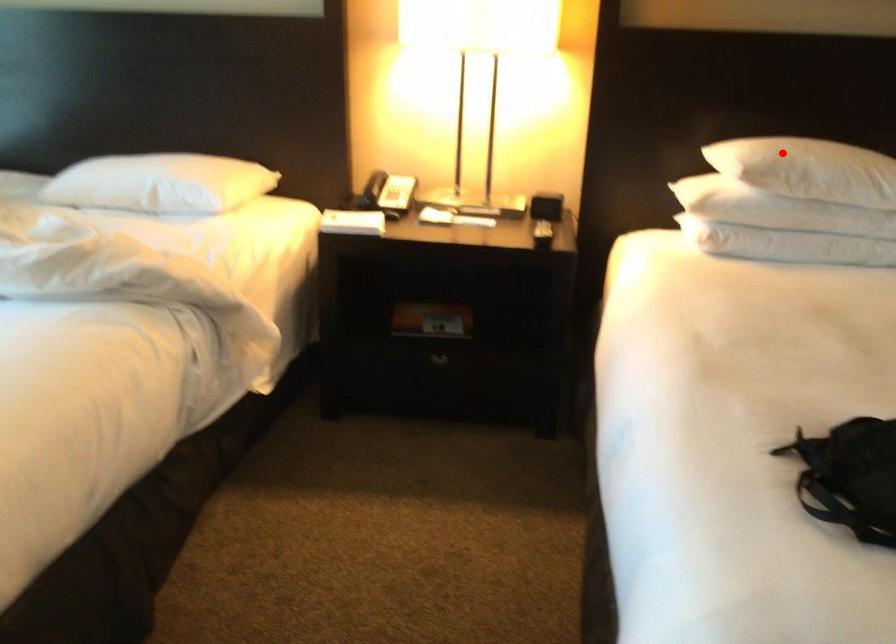
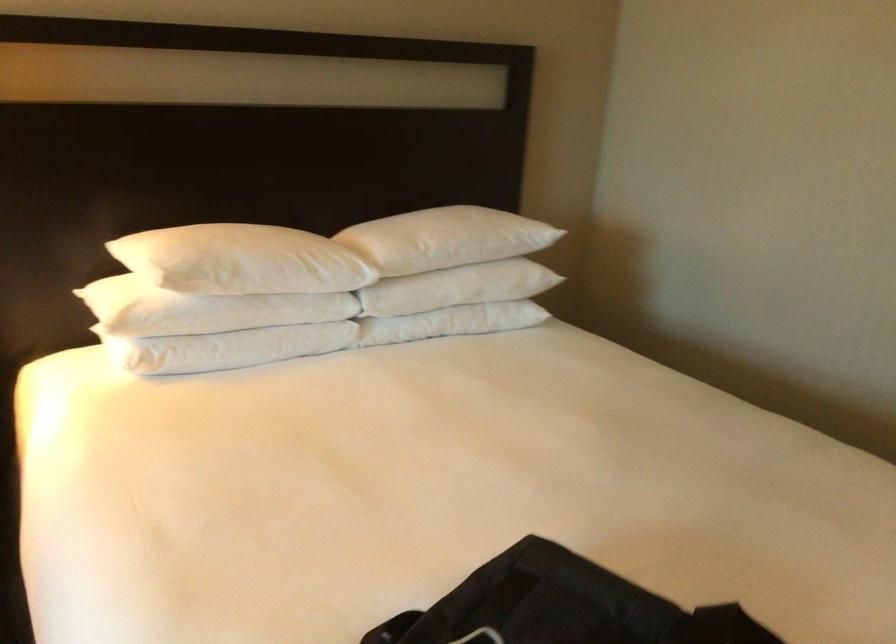
The point at the highlighted location is marked in the first image. Where is the corresponding point in the second image?

(211, 254)